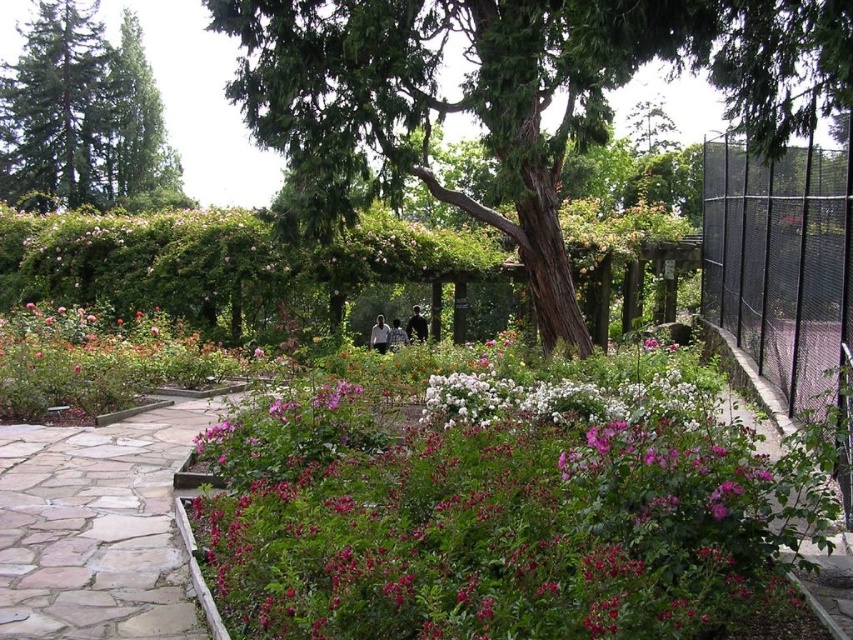
Question: Which object is the farthest from the black chain-link fence at right?

Choices:
 (A) green glossy tree at upper left
 (B) pink matte flowers at center

Answer: (A)

Question: Which point appears closest to the camera in this image?

Choices:
 (A) (740, 92)
 (B) (758, 166)

Answer: (A)

Question: Does green rough bark tree at center have a greater width compared to green glossy tree at upper left?

Choices:
 (A) yes
 (B) no

Answer: (B)

Question: Observing the image, what is the correct spatial positioning of green rough bark tree at center in reference to black chain-link fence at right?

Choices:
 (A) left
 (B) right

Answer: (A)

Question: Is pink matte flowers at center bigger than black chain-link fence at right?

Choices:
 (A) no
 (B) yes

Answer: (A)

Question: Which point is farther to the camera?

Choices:
 (A) (767, 252)
 (B) (32, 52)

Answer: (B)